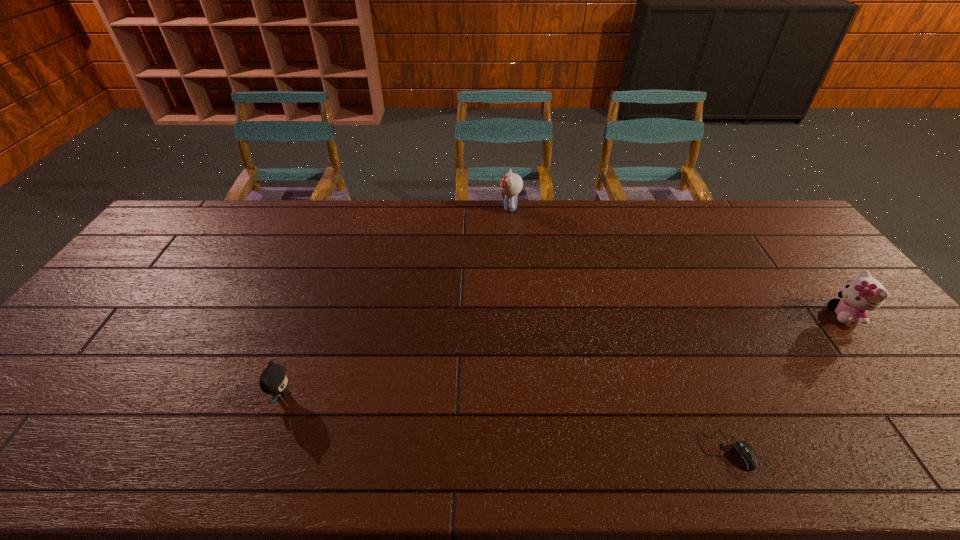
What are the coordinates of `the farthest object` in the screenshot? It's located at (511, 184).

The height and width of the screenshot is (540, 960). I want to click on the third object from right to left, so click(511, 184).

You are a GUI agent. You are given a task and a screenshot of the screen. Output one action in this format:
    pyautogui.click(x=<x>, y=<y>)
    Task: Click on the second farthest kitten
    The image size is (960, 540).
    Given the screenshot: What is the action you would take?
    pyautogui.click(x=864, y=293)

At what (x,y) coordinates should I click in order to perform the action: click on the second farthest object. Please return your answer as a coordinate pair (x, y). Looking at the image, I should click on (864, 293).

This screenshot has height=540, width=960. I want to click on the nearest kitten, so click(x=273, y=380).

Where is `the leftmost object`? The image size is (960, 540). the leftmost object is located at coordinates (273, 380).

Identify the location of computer mouse. (745, 454).

I want to click on the nearest object, so click(x=745, y=454).

Where is `free spot located 0.220m on the front-facing side of the farthest kitten`? free spot located 0.220m on the front-facing side of the farthest kitten is located at coordinates (440, 208).

Locate an element on the screen. Image resolution: width=960 pixels, height=540 pixels. vacant space situated 0.130m on the front-facing side of the farthest kitten is located at coordinates (464, 208).